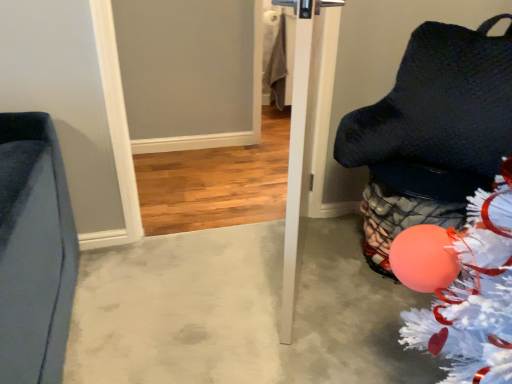
Identify the location of vacant area that lies to the right of white smooth door at center. (340, 273).